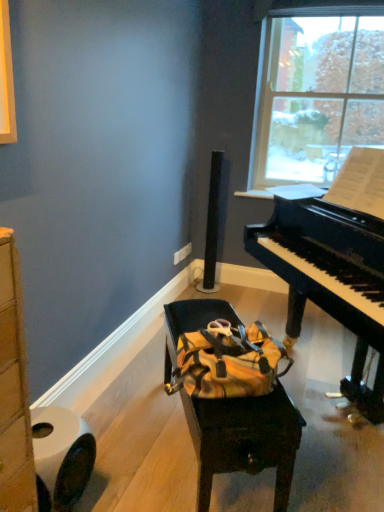
The image size is (384, 512). In order to click on vacant space underneath yellow fabric bag at center (from a real-world perspective) in this screenshot , I will do `click(206, 460)`.